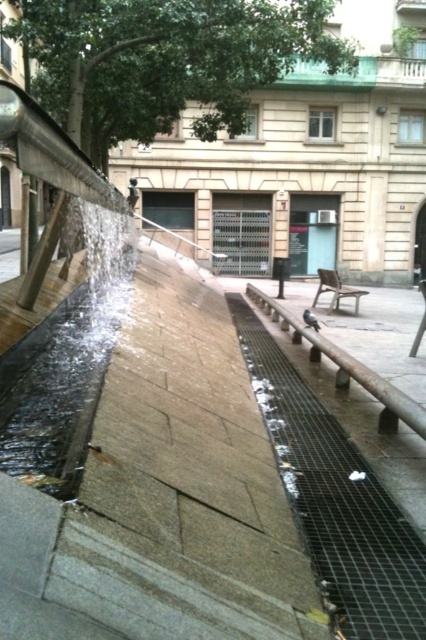
You are a maintenance worker checking the water feature. You need to ensure the clear glass water at left and brown wooden rail at center are within safety standards. According to the measurements, which object has a greater width?

The clear glass water at left has a greater width than the brown wooden rail at center.

You are sitting on the wooden park bench at center and want to get a drink of water. Is the clear glass water at left accessible from your current position?

The clear glass water at left is located below the wooden park bench at center, so you can easily access it by reaching down from the bench.

You are a maintenance worker inspecting the clear glass water at left and the brown wooden rail at center. Which object is located above the other?

The clear glass water at left is positioned over the brown wooden rail at center, so it is above the rail.